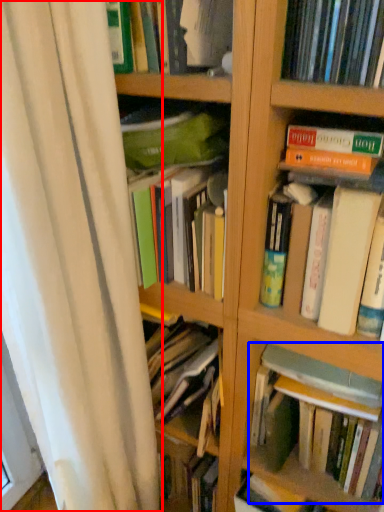
Question: Among these objects, which one is nearest to the camera, shower curtain (highlighted by a red box) or book (highlighted by a blue box)?

Choices:
 (A) shower curtain
 (B) book

Answer: (A)